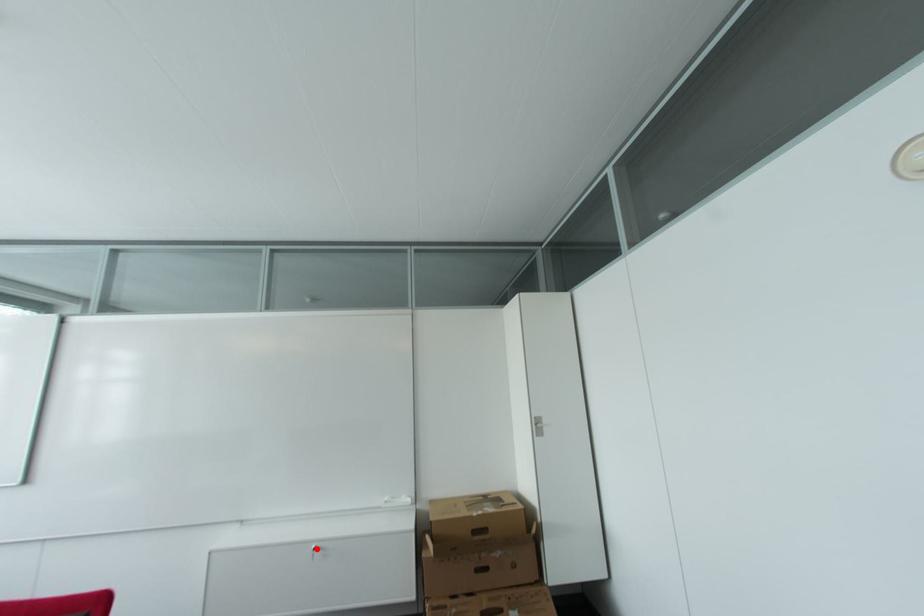
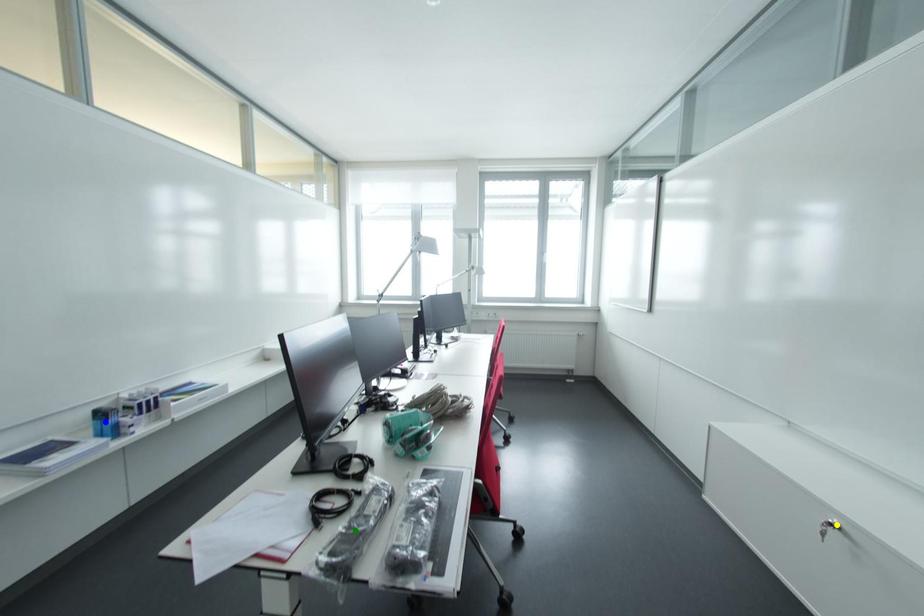
Question: I am providing you with two images of the same scene from different viewpoints. A red point is marked on the first image. You are given multiple points on the second image. Which spot in image 2 lines up with the point in image 1?

Choices:
 (A) blue point
 (B) green point
 (C) yellow point

Answer: (C)